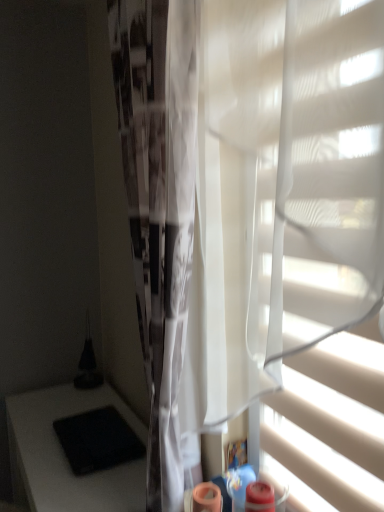
Question: Considering the relative sizes of black matte pad at lower left and white sheer fabric at center in the image provided, is black matte pad at lower left bigger than white sheer fabric at center?

Choices:
 (A) no
 (B) yes

Answer: (A)

Question: Considering the relative sizes of black matte pad at lower left and white sheer fabric at center in the image provided, is black matte pad at lower left shorter than white sheer fabric at center?

Choices:
 (A) no
 (B) yes

Answer: (B)

Question: Is black matte pad at lower left at the right side of white sheer fabric at center?

Choices:
 (A) yes
 (B) no

Answer: (B)

Question: Is white sheer fabric at center completely or partially inside black matte pad at lower left?

Choices:
 (A) yes
 (B) no

Answer: (B)

Question: Would you say black matte pad at lower left is outside white sheer fabric at center?

Choices:
 (A) no
 (B) yes

Answer: (B)

Question: Which is correct: white sheer fabric at center is inside black matte pad at lower left, or outside of it?

Choices:
 (A) inside
 (B) outside

Answer: (B)

Question: From a real-world perspective, is white sheer fabric at center positioned above or below black matte pad at lower left?

Choices:
 (A) above
 (B) below

Answer: (A)

Question: Is white sheer fabric at center in front of or behind black matte pad at lower left in the image?

Choices:
 (A) front
 (B) behind

Answer: (A)

Question: From the image's perspective, is white sheer fabric at center located above or below black matte pad at lower left?

Choices:
 (A) below
 (B) above

Answer: (B)

Question: Is white matte blind at right in front of or behind white sheer fabric at center in the image?

Choices:
 (A) front
 (B) behind

Answer: (A)

Question: Looking at their shapes, would you say white matte blind at right is wider or thinner than white sheer fabric at center?

Choices:
 (A) thin
 (B) wide

Answer: (A)

Question: From a real-world perspective, is white matte blind at right above or below white sheer fabric at center?

Choices:
 (A) below
 (B) above

Answer: (A)

Question: Is white matte blind at right inside the boundaries of white sheer fabric at center, or outside?

Choices:
 (A) inside
 (B) outside

Answer: (B)

Question: Considering the relative positions of white sheer fabric at center and black matte table at lower left in the image provided, is white sheer fabric at center to the left or to the right of black matte table at lower left?

Choices:
 (A) left
 (B) right

Answer: (B)

Question: From the image's perspective, is white sheer fabric at center positioned above or below black matte table at lower left?

Choices:
 (A) below
 (B) above

Answer: (B)